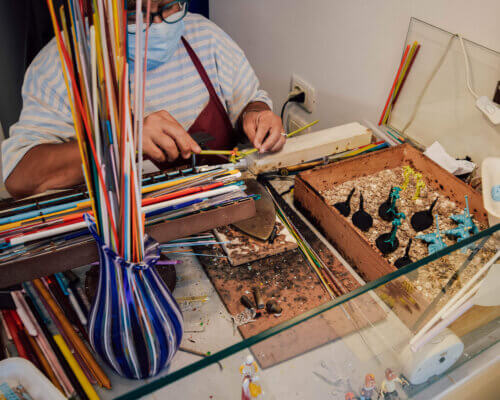
The image size is (500, 400). What are the coordinates of `black cable` in the screenshot? It's located at (298, 100).